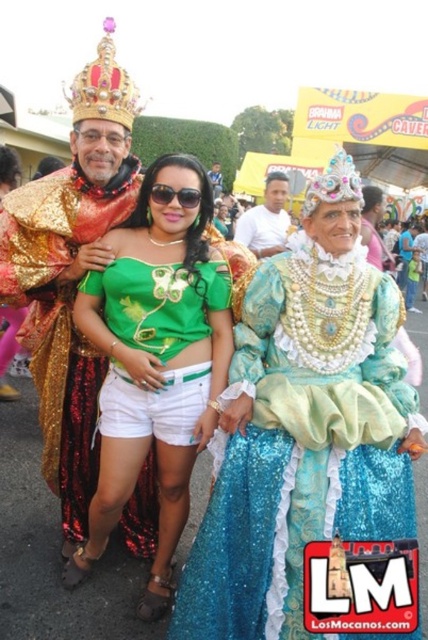
You are a photographer at the event and want to capture a clear photo of both the sequined gold robe at left and the shiny gold crown at upper left. However, you notice that one of them might be blocking the view of the other. Which object is blocking the view of the other?

The shiny gold crown at upper left is behind the sequined gold robe at left, so the sequined gold robe at left is blocking the view of the shiny gold crown at upper left.

What is located at the coordinates point (265,220) in the image?

The white cotton shirt at center is located at point (265,220).

You are a photographer at the event and want to capture a closeup of the sequined gold robe at left and the shiny gold crown at upper left in the same frame. Which object should you zoom in on first to ensure both are visible?

The sequined gold robe at left is smaller than the shiny gold crown at upper left, so you should zoom in on the shiny gold crown at upper left first to ensure both fit in the frame.